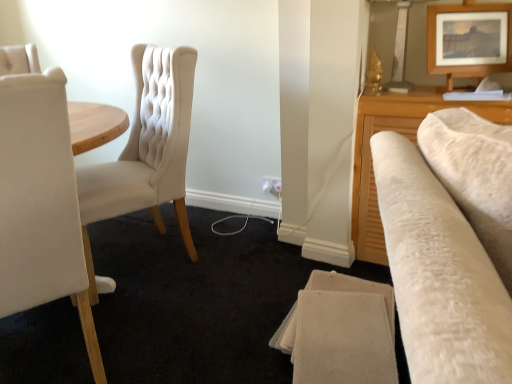
The image size is (512, 384). Find the location of `vacant region below white leather chair at left, the 2th chair when ordered from back to front (from a real-world perspective)`. vacant region below white leather chair at left, the 2th chair when ordered from back to front (from a real-world perspective) is located at coordinates (53, 351).